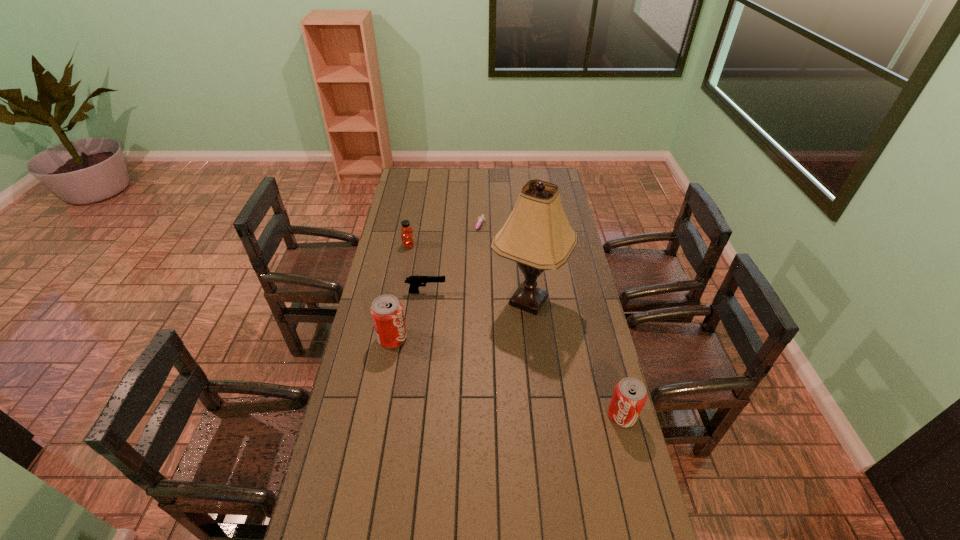
Where is `free space between the second shortest object and the second farthest object`? This screenshot has height=540, width=960. free space between the second shortest object and the second farthest object is located at coordinates (418, 269).

At what (x,y) coordinates should I click in order to perform the action: click on vacant space that's between the fourth object from left to right and the third shortest object. Please return your answer as a coordinate pair (x, y). Looking at the image, I should click on (444, 237).

Locate an element on the screen. free space that is in between the fifth shortest object and the shorter soda can is located at coordinates (507, 377).

Locate an element on the screen. This screenshot has height=540, width=960. free spot between the fifth shortest object and the honey is located at coordinates (400, 292).

This screenshot has height=540, width=960. I want to click on vacant area between the tallest object and the fourth shortest object, so pyautogui.click(x=575, y=358).

At what (x,y) coordinates should I click in order to perform the action: click on free spot between the fifth object from left to right and the honey. Please return your answer as a coordinate pair (x, y). Looking at the image, I should click on (468, 273).

This screenshot has width=960, height=540. What are the coordinates of `the third closest object to the nearest object` in the screenshot? It's located at (415, 282).

In order to click on object identified as the closest to the farthest object in this screenshot , I will do `click(537, 235)`.

Where is `free region that satisfies the following two spatial constraints: 1. on the front-facing side of the pistol; 2. on the left side of the lamp`? This screenshot has height=540, width=960. free region that satisfies the following two spatial constraints: 1. on the front-facing side of the pistol; 2. on the left side of the lamp is located at coordinates (425, 301).

Image resolution: width=960 pixels, height=540 pixels. I want to click on free location that satisfies the following two spatial constraints: 1. on the front label of the honey; 2. on the back side of the left soda can, so (x=392, y=338).